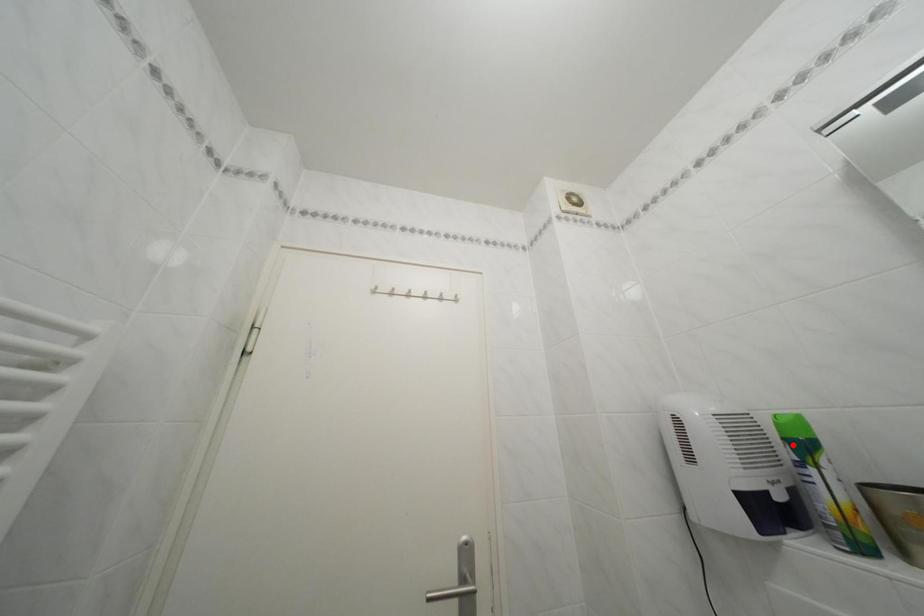
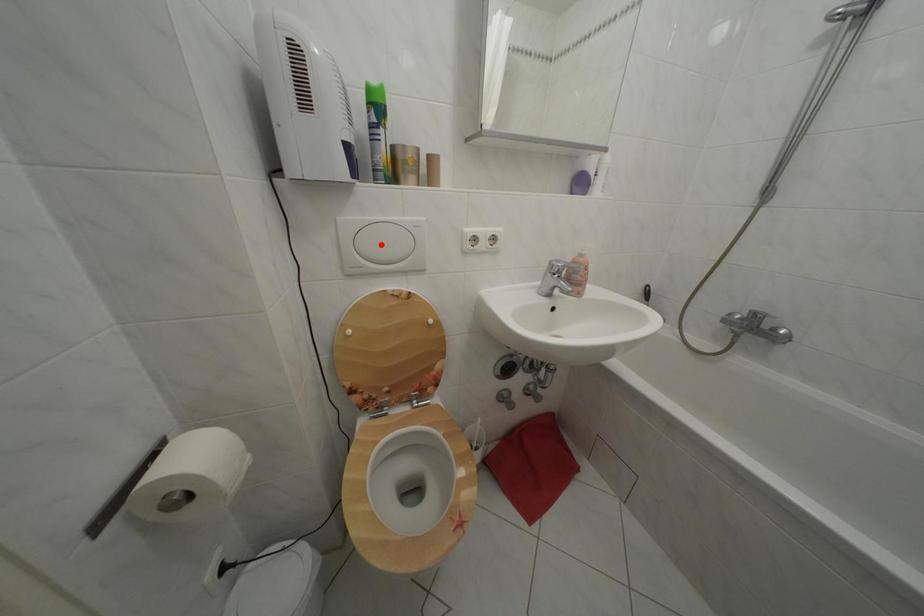
I am providing you with two images of the same scene from different viewpoints. A red point is marked on the first image and another point is marked on the second image. Do the highlighted points in image1 and image2 indicate the same real-world spot?

No